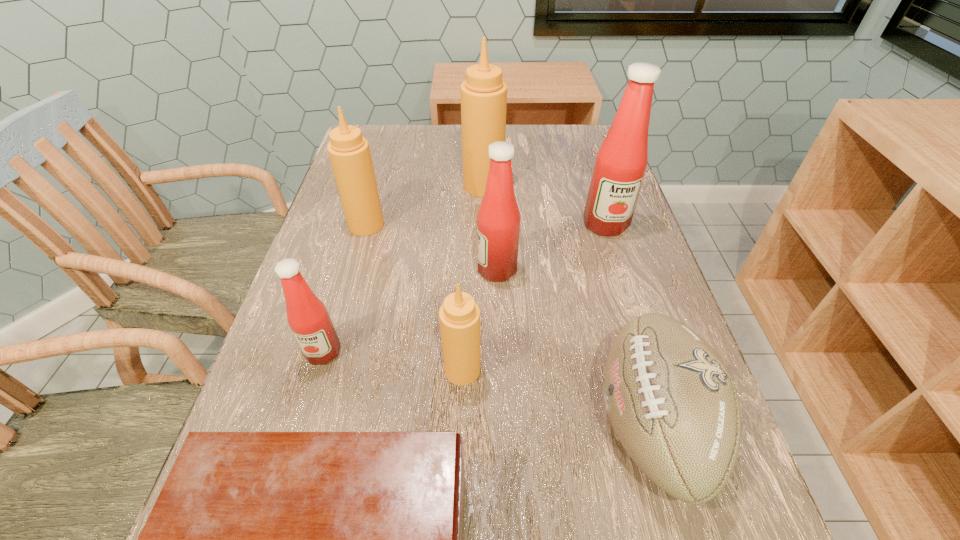
At what (x,y) coordinates should I click in order to perform the action: click on vacant space located 0.130m on the laces of the football (American). Please return your answer as a coordinate pair (x, y). Looking at the image, I should click on (516, 424).

In order to click on vacant space positioned 0.110m on the laces of the football (American) in this screenshot , I will do `click(529, 424)`.

Image resolution: width=960 pixels, height=540 pixels. What are the coordinates of `vacant space located on the laces of the football (American)` in the screenshot? It's located at (396, 424).

The width and height of the screenshot is (960, 540). In order to click on condiment that is at the right edge in this screenshot , I will do `click(621, 161)`.

Where is `football (American) at the right edge`? football (American) at the right edge is located at coordinates (671, 400).

This screenshot has height=540, width=960. I want to click on blank space at the far edge, so click(x=554, y=156).

Image resolution: width=960 pixels, height=540 pixels. I want to click on vacant space at the left edge of the desktop, so click(x=365, y=239).

Image resolution: width=960 pixels, height=540 pixels. In the image, there is a desktop. Find the location of `free region at the right edge`. free region at the right edge is located at coordinates (645, 243).

Where is `vacant space at the far left corner of the desktop`? This screenshot has width=960, height=540. vacant space at the far left corner of the desktop is located at coordinates (372, 135).

Identify the location of empty location between the nearest tan condiment and the second smallest tan condiment. This screenshot has height=540, width=960. (415, 297).